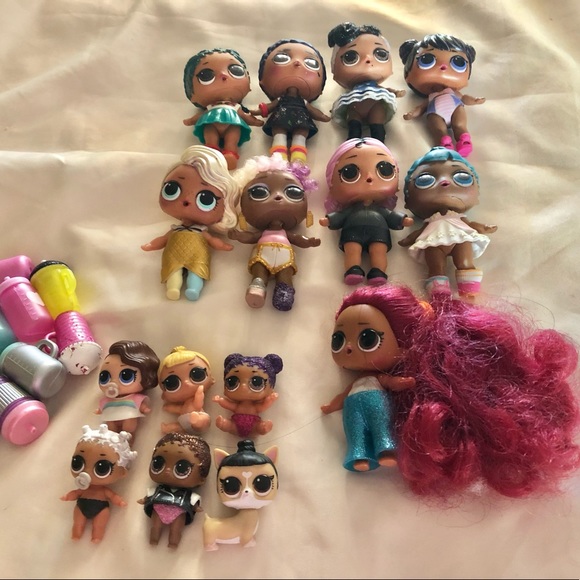
Find the location of a particular element. drinking cup is located at coordinates (3, 328), (21, 309), (10, 269), (63, 295), (74, 333), (39, 369), (21, 404).